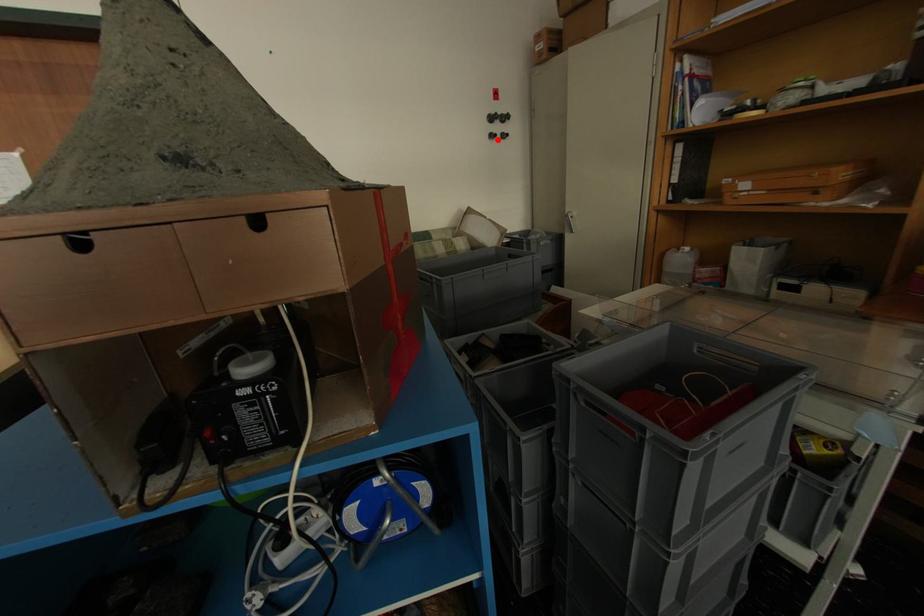
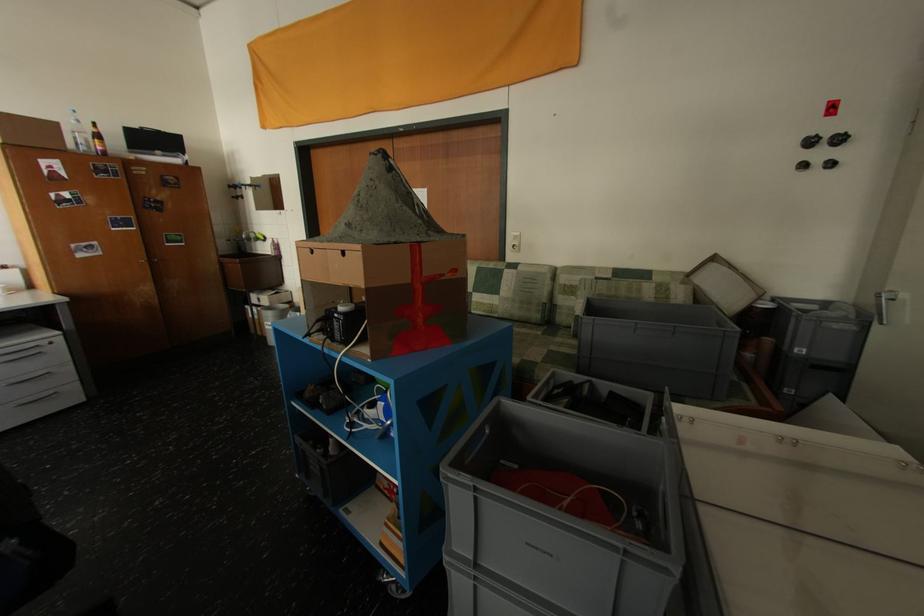
Locate, in the second image, the point that corresponds to the highlighted location in the first image.

(806, 169)